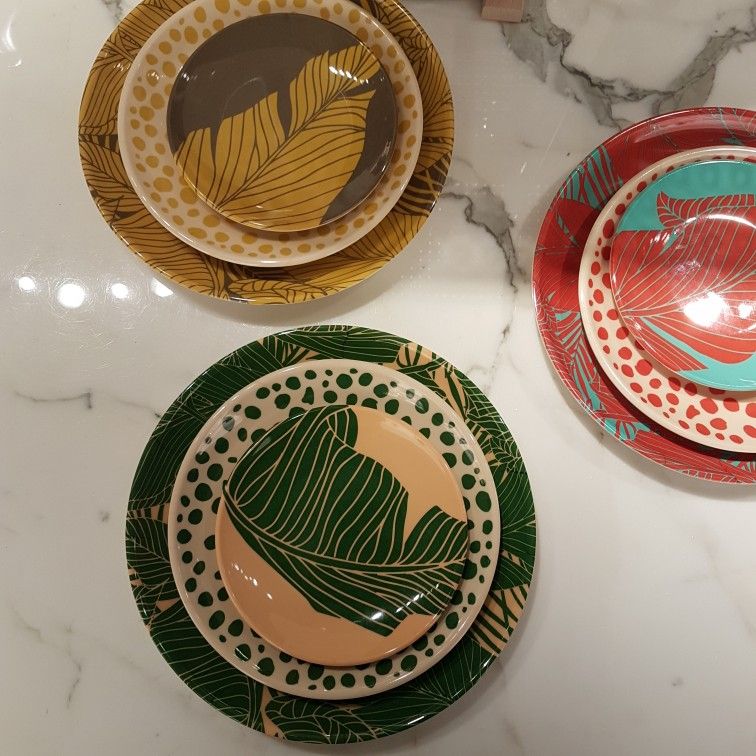
This screenshot has width=756, height=756. I want to click on plates, so click(x=385, y=600), click(x=426, y=652), click(x=445, y=688), click(x=655, y=290), click(x=608, y=341), click(x=569, y=349), click(x=276, y=138), click(x=380, y=209), click(x=401, y=225).